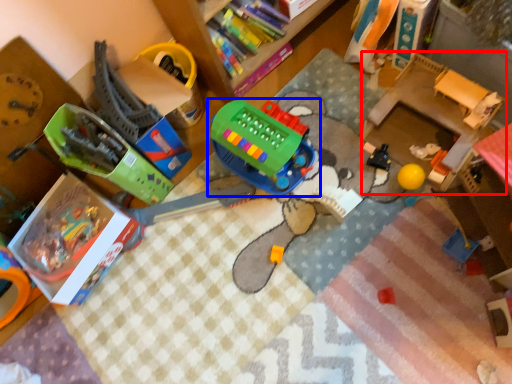
Question: Among these objects, which one is nearest to the camera, changing table (highlighted by a red box) or toy (highlighted by a blue box)?

Choices:
 (A) changing table
 (B) toy

Answer: (A)